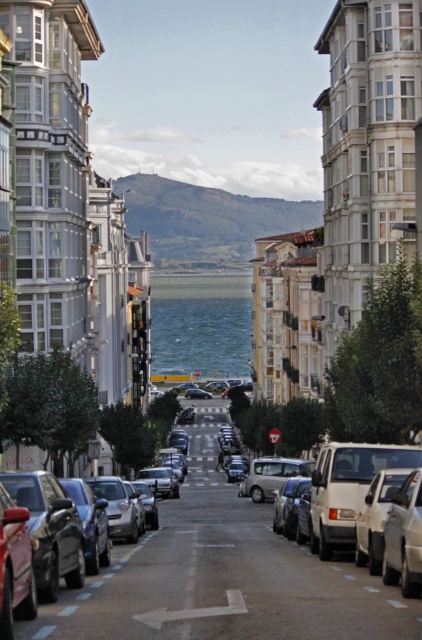
You are a delivery driver navigating through the narrow urban street. You notice a clear water at center and a matte white car at center. Which object is taller from your perspective?

The clear water at center has a greater height compared to the matte white car at center, so the clear water at center is taller.

You are a delivery drone flying over an urban street. You need to land on the clear water at center. What coordinates should you aim for?

The clear water at center is located at coordinates point (200,324), so you should aim for those coordinates.

You are driving a delivery van that is 2.5 meters wide. You need to navigate through the narrow urban street shown in the image. Can your van pass through the gap between the clear water at center and the matte white car at center?

The clear water at center might be wider than matte white car at center, so there is a possibility that the gap is wide enough for the delivery van to pass through. However, since the exact width isn not specified, proceed with caution.